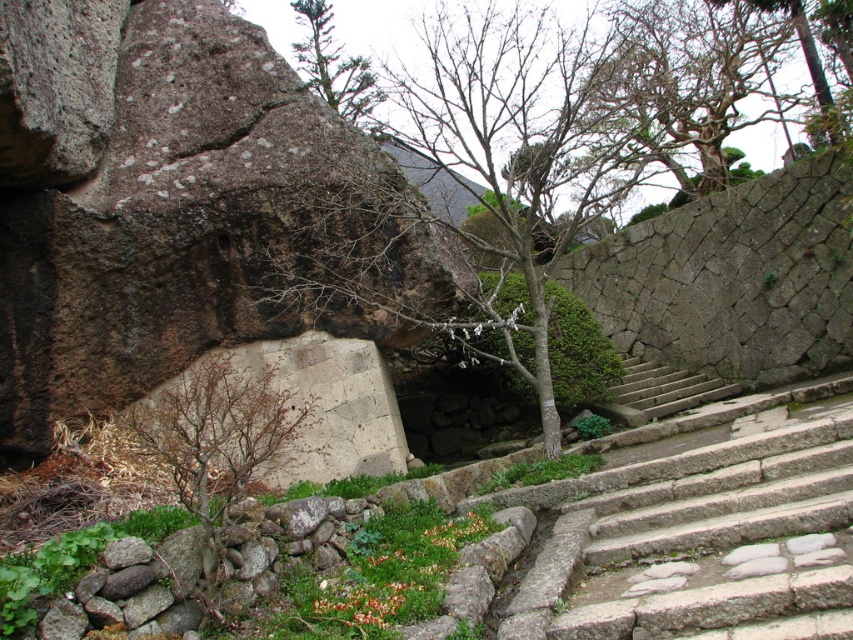
Question: Considering the relative positions of green leafy tree at center and green leafy tree at upper center in the image provided, where is green leafy tree at center located with respect to green leafy tree at upper center?

Choices:
 (A) right
 (B) left

Answer: (A)

Question: Among these points, which one is nearest to the camera?

Choices:
 (A) (729, 387)
 (B) (204, 476)

Answer: (B)

Question: Among these objects, which one is farthest from the camera?

Choices:
 (A) green leafy tree at upper center
 (B) green leafy tree at center
 (C) brown textured tree at lower left
 (D) gray stone stairs at center

Answer: (A)

Question: Does brown textured tree at lower left have a smaller size compared to green leafy tree at upper center?

Choices:
 (A) yes
 (B) no

Answer: (B)

Question: Does green leafy tree at center have a greater width compared to gray stone stairs at center?

Choices:
 (A) yes
 (B) no

Answer: (A)

Question: Among these objects, which one is farthest from the camera?

Choices:
 (A) green leafy tree at center
 (B) green leafy tree at upper center
 (C) gray stone stairs at center
 (D) brown textured tree at lower left

Answer: (B)